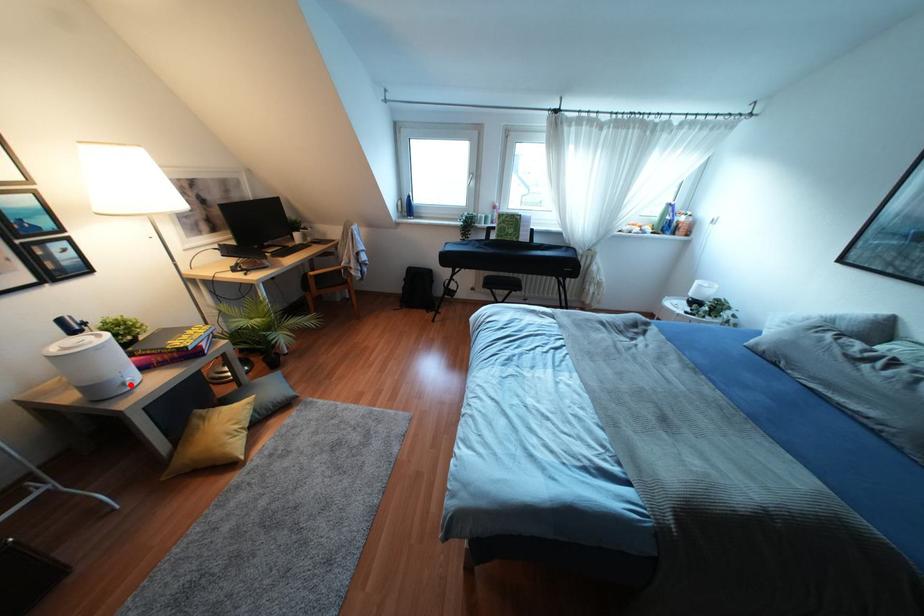
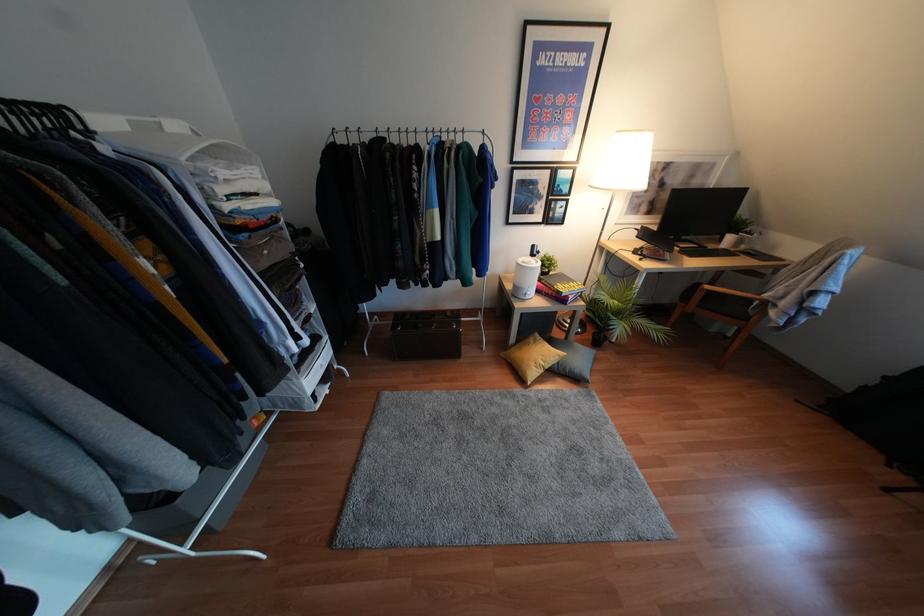
Question: A red point is marked in image1. In image2, is the corresponding 3D point closer to the camera or farther? Reply with the corresponding letter.

Choices:
 (A) The corresponding 3D point is closer.
 (B) The corresponding 3D point is farther.

Answer: (A)